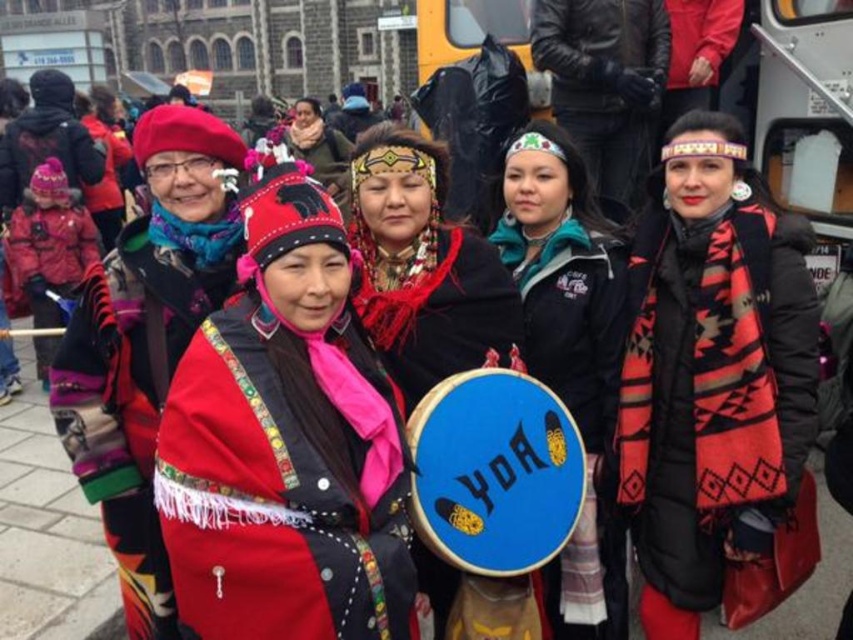
Question: Is matte red blanket at center smaller than matte pink snowsuit at left?

Choices:
 (A) yes
 (B) no

Answer: (B)

Question: Is velvet red shawl at center positioned in front of matte pink snowsuit at left?

Choices:
 (A) no
 (B) yes

Answer: (B)

Question: Based on their relative distances, which object is nearer to the matte black coat at center?

Choices:
 (A) red and black woven scarf at center
 (B) velvet red shawl at center
 (C) matte black beret at upper left
 (D) matte pink snowsuit at left

Answer: (B)

Question: Which object appears farthest from the camera in this image?

Choices:
 (A) matte red blanket at center
 (B) matte black beret at upper left
 (C) red and black woven scarf at center
 (D) velvet red shawl at center

Answer: (B)

Question: Does red and black woven scarf at center appear on the left side of teal fabric jacket at center?

Choices:
 (A) no
 (B) yes

Answer: (A)

Question: Which of the following is the closest to the observer?

Choices:
 (A) matte red blanket at center
 (B) matte pink snowsuit at left
 (C) red and black woven scarf at center

Answer: (C)